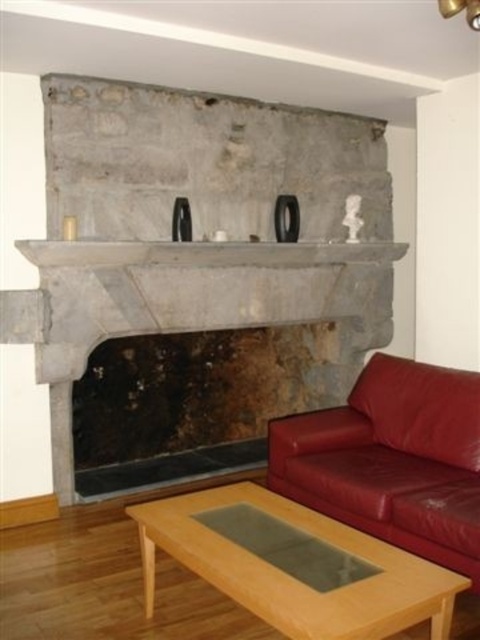
You are standing in the living room and want to place a small plant between the two points, point 1 at (x=264, y=307) and point 2 at (x=335, y=509). Which point should the plant be closer to so it appears closer to you?

The plant should be closer to point 1 at (x=264, y=307) because it is further to the viewer than point 2 at (x=335, y=509).

You are standing in the living room and want to place a 2.5 feet wide rectangular box on the light brown wood coffee table at lower center. Can the box fit on the table?

The light brown wood coffee table at lower center is 5.66 feet away from camera. The distance from the camera does not indicate the table size, so we cannot determine if the box will fit based on the provided information.